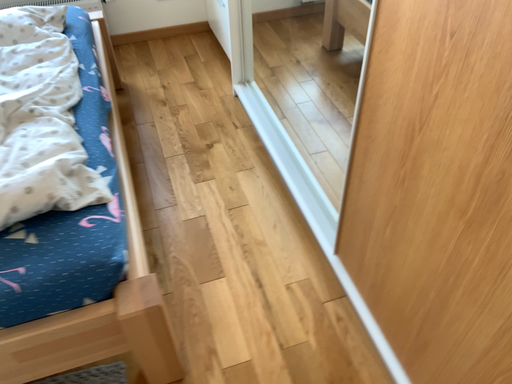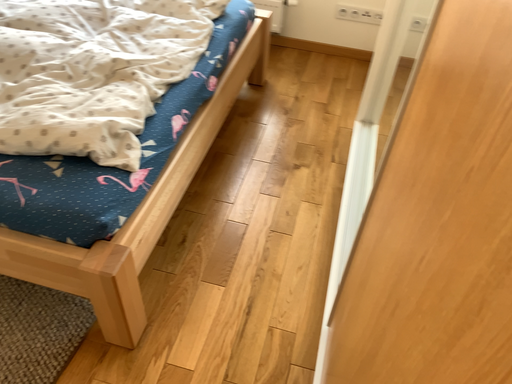
Question: Which way did the camera rotate in the video?

Choices:
 (A) rotated left
 (B) rotated right

Answer: (A)